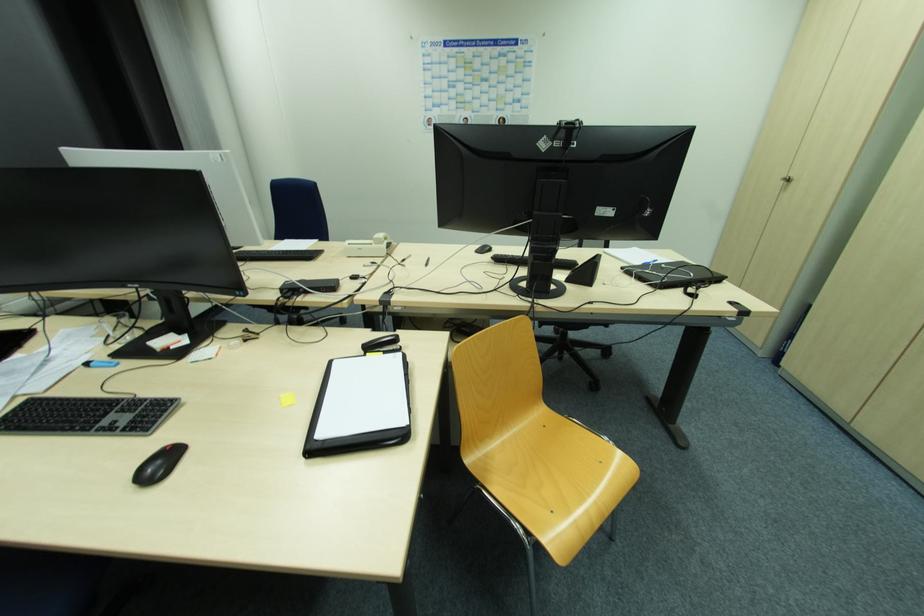
Where would you squeez the black stapler? Please return your answer as a coordinate pair (x, y).

(382, 344)